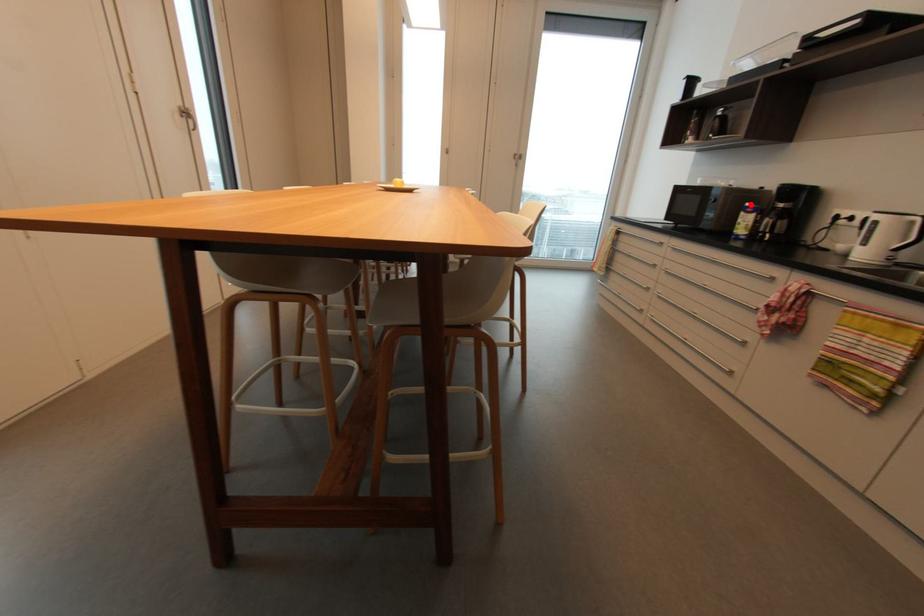
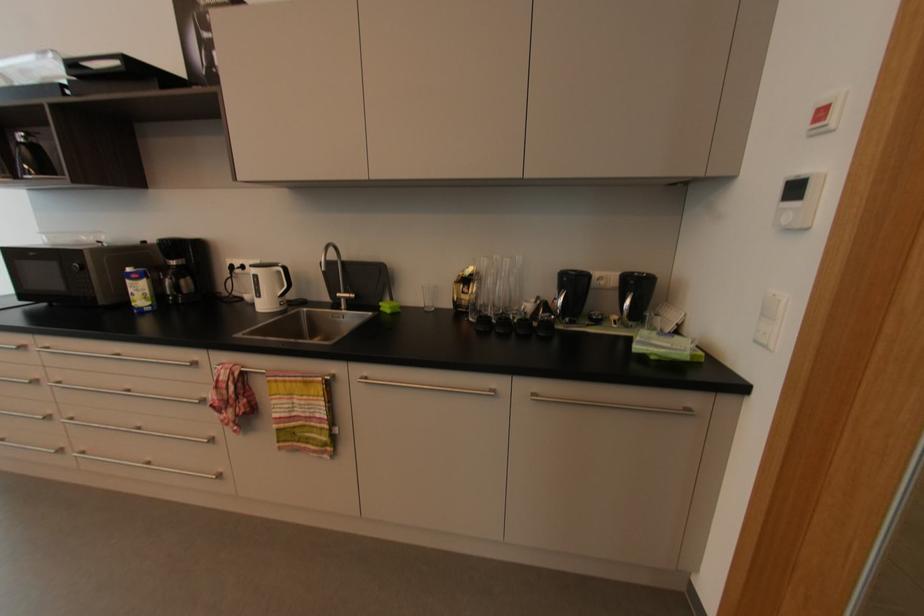
Find the pixel in the second image that matches the highlighted location in the first image.

(131, 270)